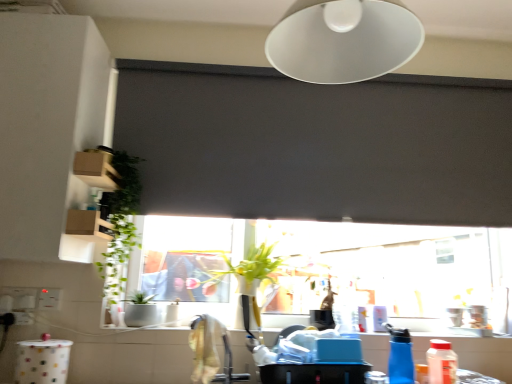
Question: Is point (130, 314) closer or farther from the camera than point (437, 357)?

Choices:
 (A) closer
 (B) farther

Answer: (B)

Question: In terms of height, does white ceramic sink at window look taller or shorter compared to translucent plastic bottle at lower right, which is the second bottle from left to right?

Choices:
 (A) tall
 (B) short

Answer: (B)

Question: Which is farther from the white matte lampshade at upper center?

Choices:
 (A) white plastic electric outlet at lower left
 (B) translucent plastic bottle at lower right, the 1th bottle viewed from the right
 (C) white ceramic sink at window
 (D) transparent glass window at center
 (E) blue plastic bottle at lower right, arranged as the 1th bottle when viewed from the left

Answer: (A)

Question: Which object is the farthest from the translucent plastic bottle at lower right, which is the second bottle from left to right?

Choices:
 (A) white ceramic sink at window
 (B) white plastic electric outlet at lower left
 (C) transparent glass window at center
 (D) blue plastic bottle at lower right, positioned as the second bottle in right-to-left order
 (E) white matte lampshade at upper center

Answer: (B)